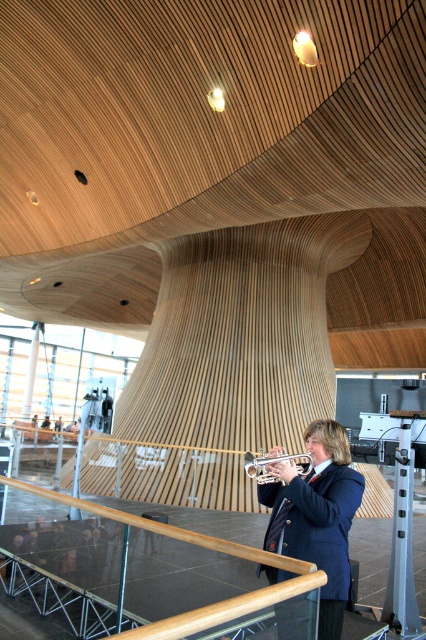
Question: Can you confirm if shiny blue blazer at center is smaller than wooden polished rail at center?

Choices:
 (A) yes
 (B) no

Answer: (A)

Question: Which object is positioned closest to the wooden polished rail at center?

Choices:
 (A) silver metallic trumpet at center
 (B) shiny blue blazer at center

Answer: (B)

Question: Among these objects, which one is nearest to the camera?

Choices:
 (A) shiny blue blazer at center
 (B) silver metallic trumpet at center

Answer: (A)

Question: Does shiny blue blazer at center appear under wooden polished rail at center?

Choices:
 (A) yes
 (B) no

Answer: (B)

Question: Is shiny blue blazer at center closer to camera compared to wooden polished rail at center?

Choices:
 (A) yes
 (B) no

Answer: (B)

Question: Which point is closer to the camera?

Choices:
 (A) shiny blue blazer at center
 (B) wooden polished rail at center
 (C) silver metallic trumpet at center

Answer: (B)